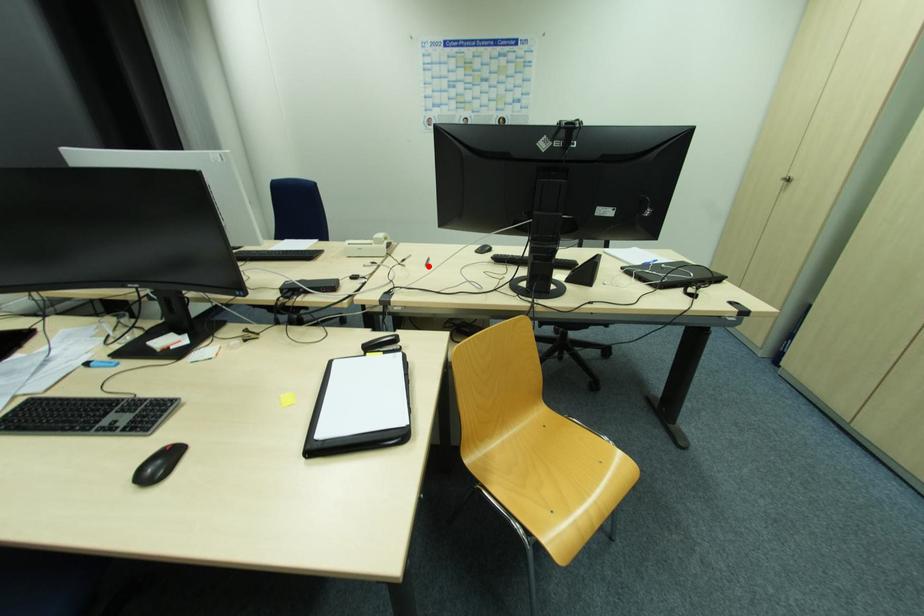
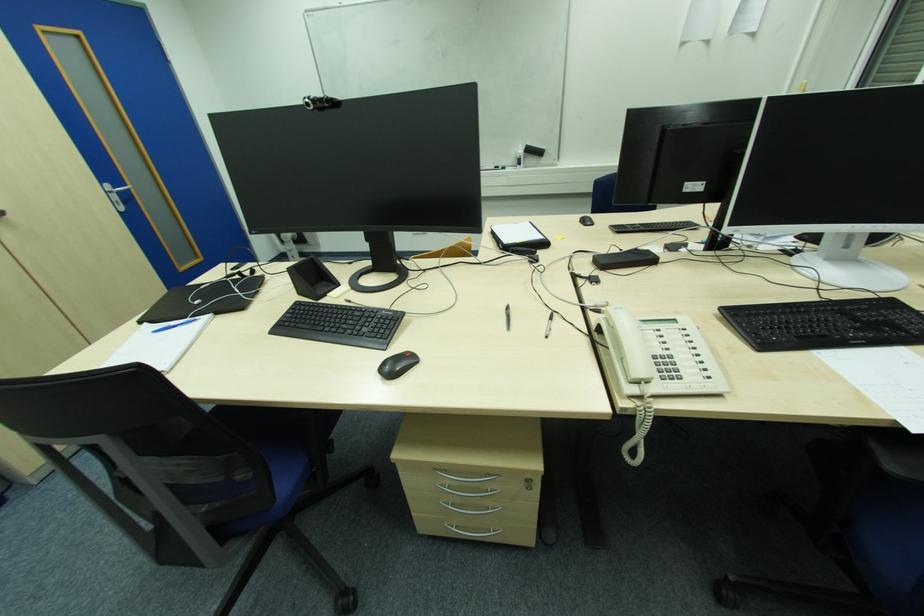
The point at the highlighted location is marked in the first image. Where is the corresponding point in the second image?

(509, 309)